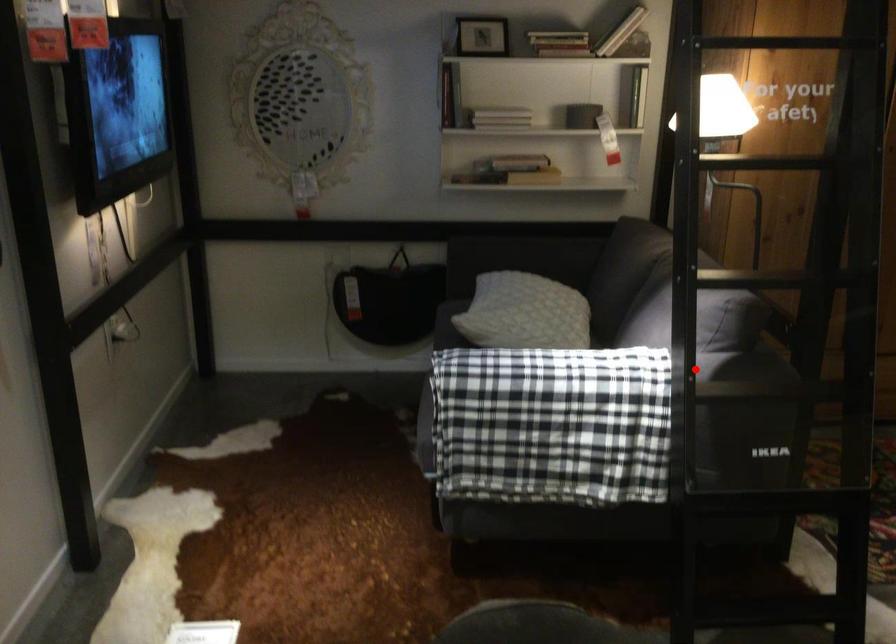
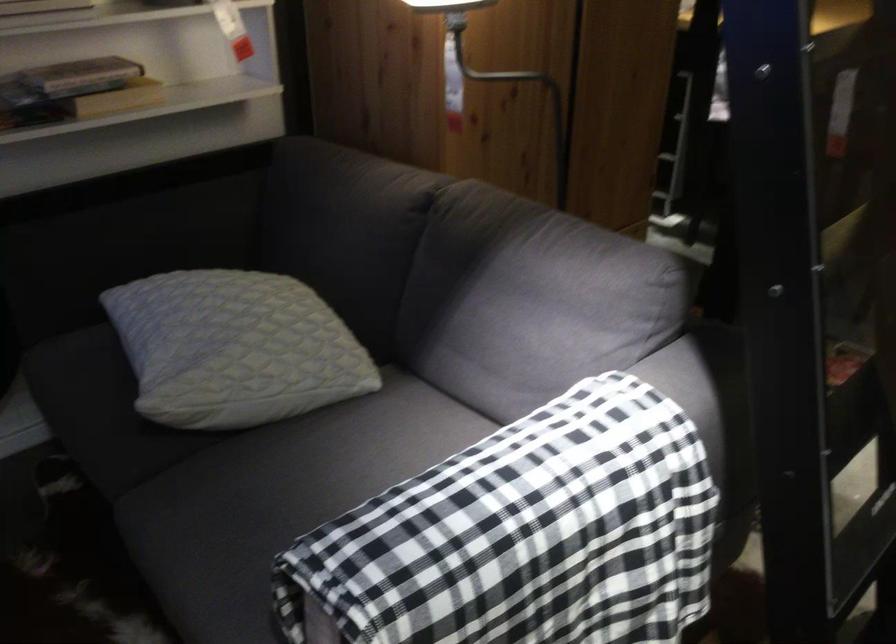
Question: I am providing you with two images of the same scene from different viewpoints. Image1 has a red point marked. In image2, the corresponding 3D location appears at what relative position? Reply with the corresponding letter.

Choices:
 (A) Closer
 (B) Farther

Answer: (A)